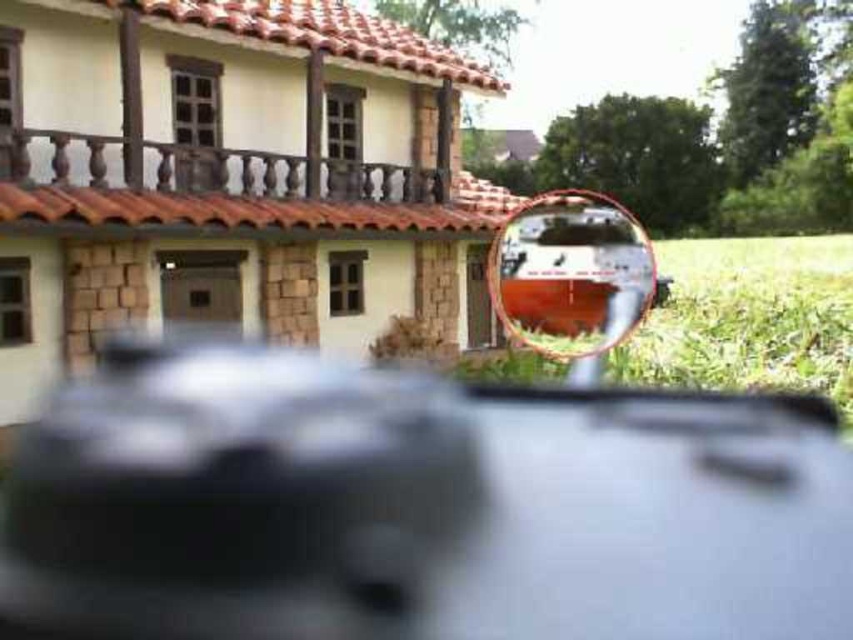
In the scene shown: Between green grass at lower right and clear glass rearview mirror at center, which one appears on the right side from the viewer's perspective?

green grass at lower right is more to the right.

Who is taller, green grass at lower right or clear glass rearview mirror at center?

With more height is green grass at lower right.

Between point (788, 246) and point (532, 246), which one is positioned in front?

Positioned in front is point (532, 246).

Find the location of a particular element. green grass at lower right is located at coordinates (747, 317).

Between metallic silver car at center and green grass at lower right, which one appears on the right side from the viewer's perspective?

From the viewer's perspective, green grass at lower right appears more on the right side.

Does point (828, 515) lie in front of point (699, 275)?

Yes.

Does point (270, 490) lie in front of point (833, 252)?

Yes, point (270, 490) is in front of point (833, 252).

Locate an element on the screen. The image size is (853, 640). metallic silver car at center is located at coordinates (415, 504).

The image size is (853, 640). Find the location of `metallic silver car at center`. metallic silver car at center is located at coordinates (415, 504).

Between point (653, 532) and point (631, 301), which one is positioned in front?

Point (653, 532)

Where is `metallic silver car at center`? Image resolution: width=853 pixels, height=640 pixels. metallic silver car at center is located at coordinates (415, 504).